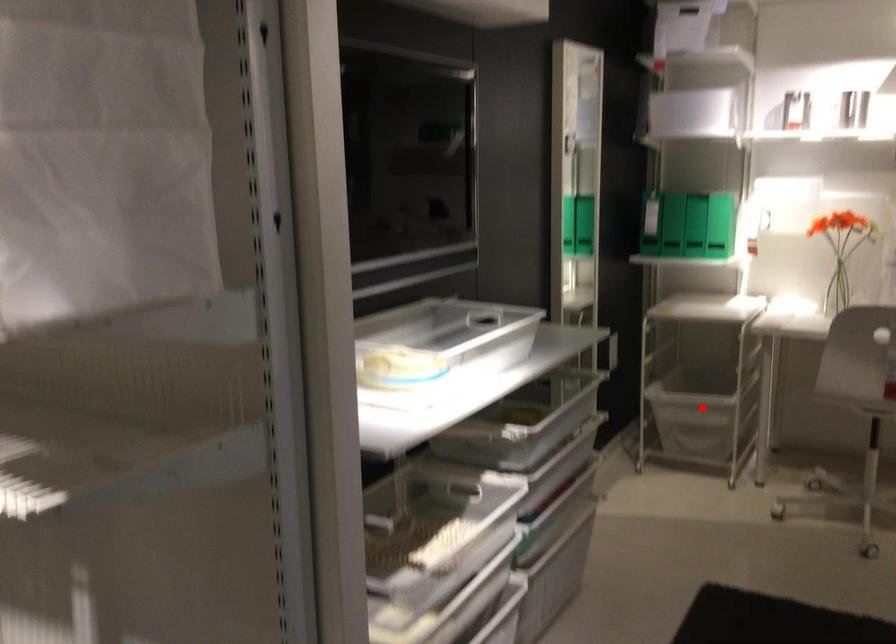
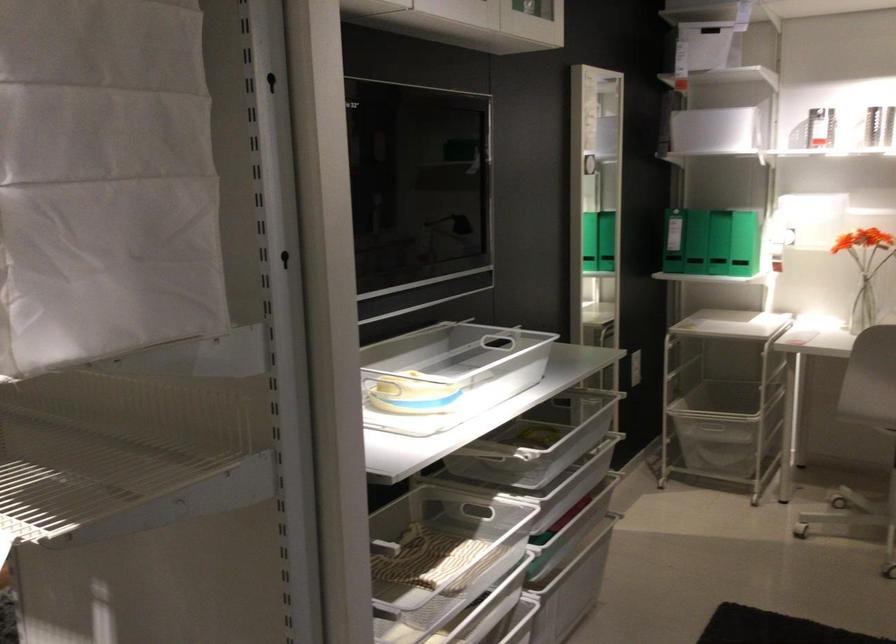
The point at the highlighted location is marked in the first image. Where is the corresponding point in the second image?

(712, 430)